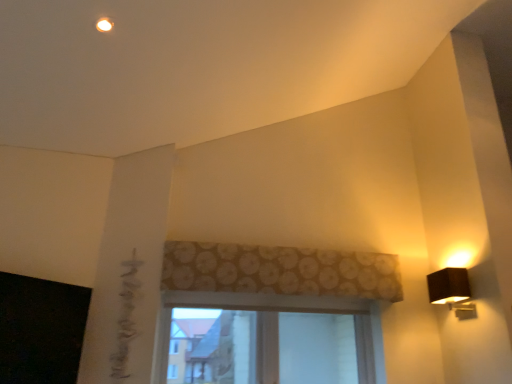
Question: Is clear glass window at center next to black fabric lamp at right and touching it?

Choices:
 (A) yes
 (B) no

Answer: (B)

Question: From the image's perspective, is clear glass window at center located above black fabric lamp at right?

Choices:
 (A) yes
 (B) no

Answer: (B)

Question: Is clear glass window at center not close to black fabric lamp at right?

Choices:
 (A) yes
 (B) no

Answer: (B)

Question: Is clear glass window at center smaller than black fabric lamp at right?

Choices:
 (A) yes
 (B) no

Answer: (B)

Question: Is clear glass window at center further to the viewer compared to black fabric lamp at right?

Choices:
 (A) yes
 (B) no

Answer: (A)

Question: Considering the relative positions of brown floral fabric at center and black matte window screen at lower left in the image provided, is brown floral fabric at center to the left or to the right of black matte window screen at lower left?

Choices:
 (A) left
 (B) right

Answer: (B)

Question: From the image's perspective, is brown floral fabric at center positioned above or below black matte window screen at lower left?

Choices:
 (A) above
 (B) below

Answer: (A)

Question: Choose the correct answer: Is brown floral fabric at center inside black matte window screen at lower left or outside it?

Choices:
 (A) inside
 (B) outside

Answer: (B)

Question: Considering their positions, is brown floral fabric at center located in front of or behind black matte window screen at lower left?

Choices:
 (A) front
 (B) behind

Answer: (B)

Question: Is brown floral fabric at center bigger or smaller than black fabric lamp at right?

Choices:
 (A) small
 (B) big

Answer: (B)

Question: Is brown floral fabric at center taller or shorter than black fabric lamp at right?

Choices:
 (A) short
 (B) tall

Answer: (B)

Question: Which is correct: brown floral fabric at center is inside black fabric lamp at right, or outside of it?

Choices:
 (A) outside
 (B) inside

Answer: (A)

Question: From the image's perspective, is brown floral fabric at center located above or below black fabric lamp at right?

Choices:
 (A) below
 (B) above

Answer: (B)

Question: Is brown floral fabric at center to the left or to the right of clear glass window at center in the image?

Choices:
 (A) right
 (B) left

Answer: (A)

Question: Is brown floral fabric at center in front of or behind clear glass window at center in the image?

Choices:
 (A) front
 (B) behind

Answer: (A)